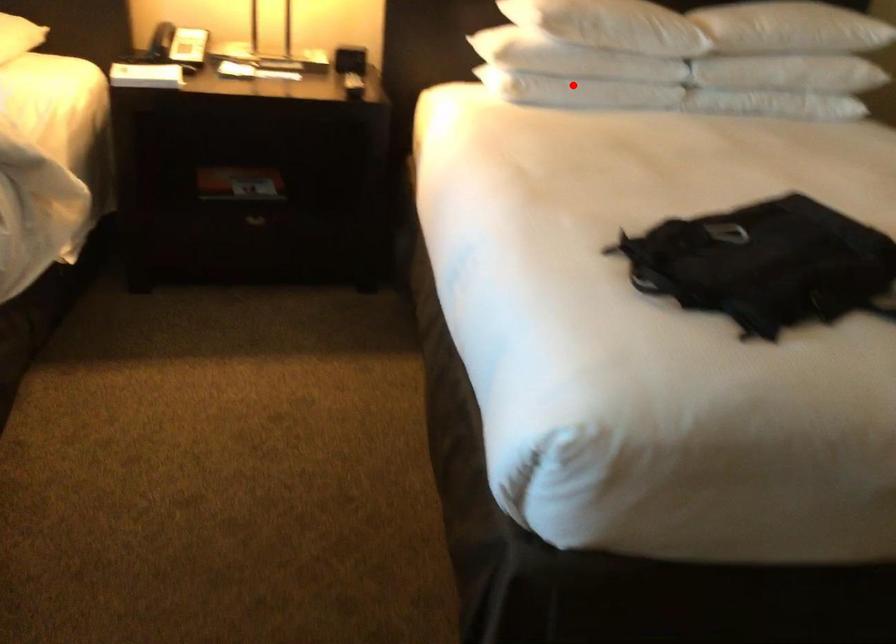
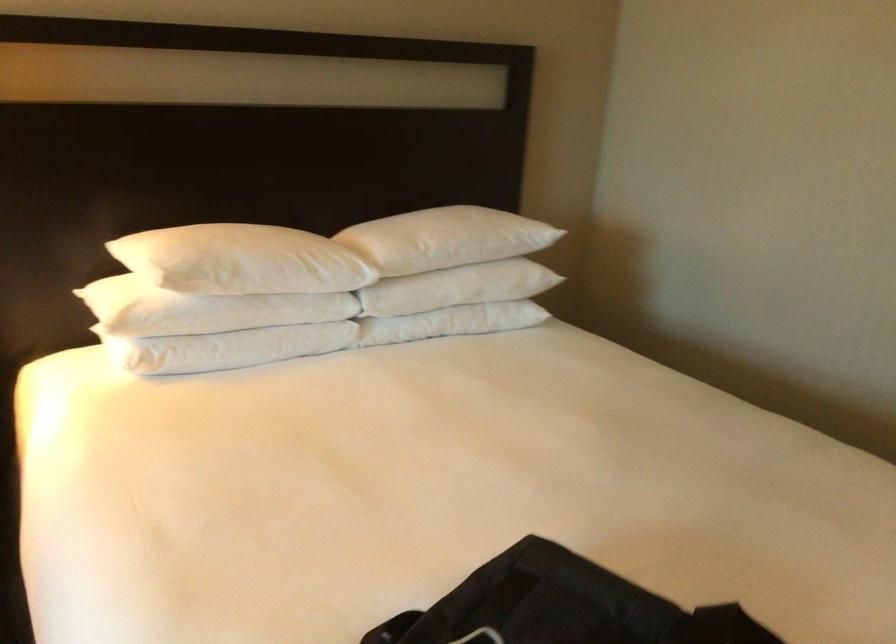
In the second image, find the point that corresponds to the highlighted location in the first image.

(226, 348)